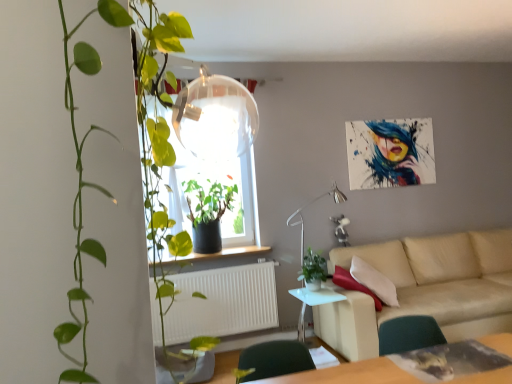
Question: From a real-world perspective, is green glossy plant at left, which is the third houseplant from back to front, above or below white matte radiator at lower center?

Choices:
 (A) above
 (B) below

Answer: (A)

Question: Is green glossy plant at left, which appears as the 1th houseplant when viewed from the front, inside or outside of white matte radiator at lower center?

Choices:
 (A) outside
 (B) inside

Answer: (A)

Question: Estimate the real-world distances between objects in this image. Which object is farther from the smooth wooden window sill at center?

Choices:
 (A) metallic silver lamp at center
 (B) transparent glass window at center
 (C) white glossy side table at lower center
 (D) green matte plant at window, the 3th houseplant positioned from the front
 (E) green matte plant at center, acting as the second houseplant starting from the front

Answer: (B)

Question: Which of these objects is positioned farthest from the green matte plant at window, the first houseplant from the back?

Choices:
 (A) white matte radiator at lower center
 (B) transparent glass window at center
 (C) green glossy plant at left, which appears as the 1th houseplant when viewed from the front
 (D) beige fabric couch at lower right
 (E) smooth wooden window sill at center

Answer: (C)